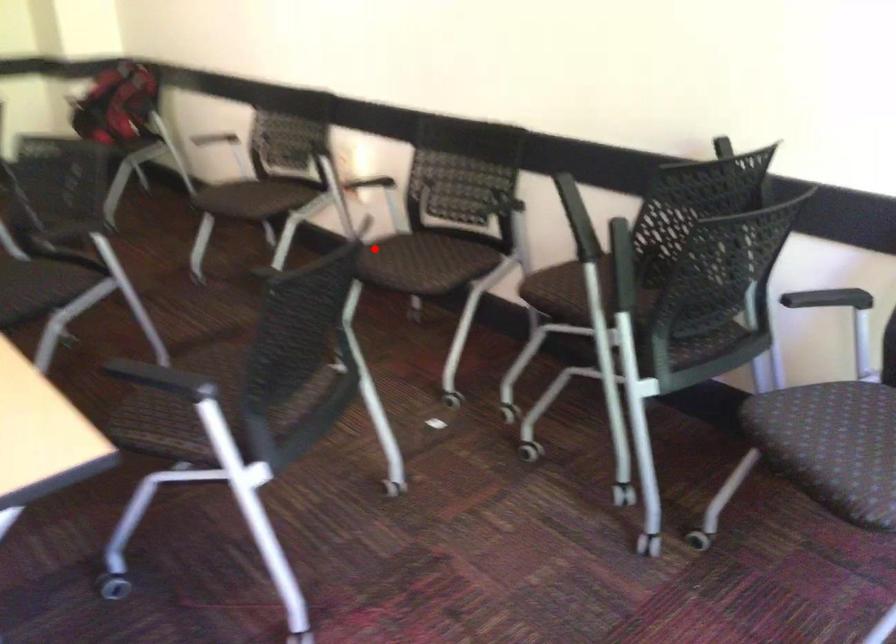
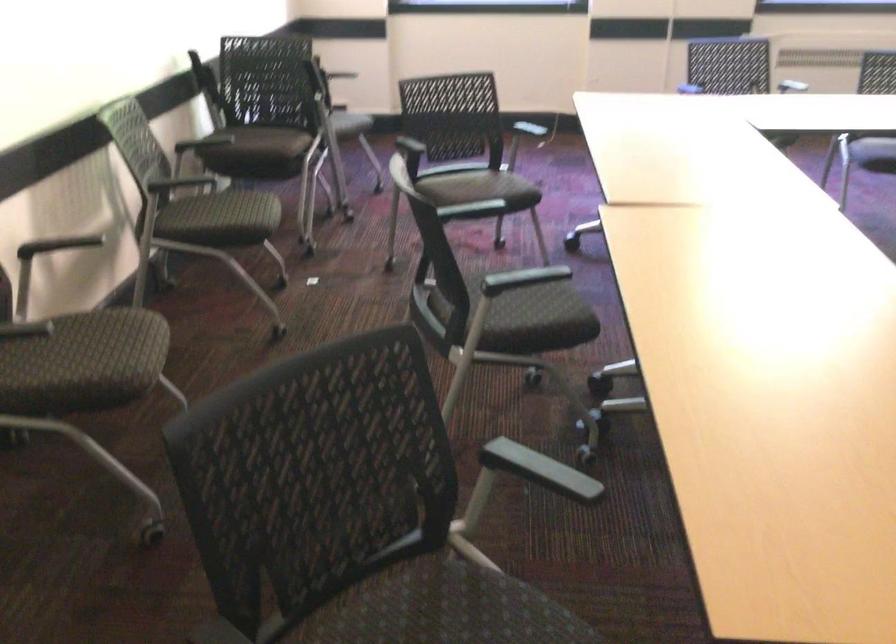
Where in the second image is the point corresponding to the highlighted location from the first image?

(250, 216)